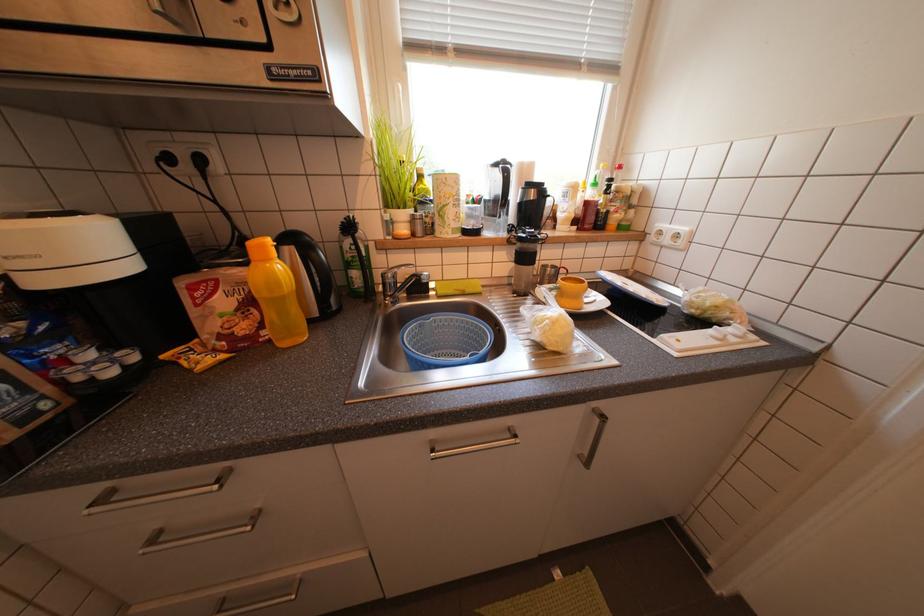
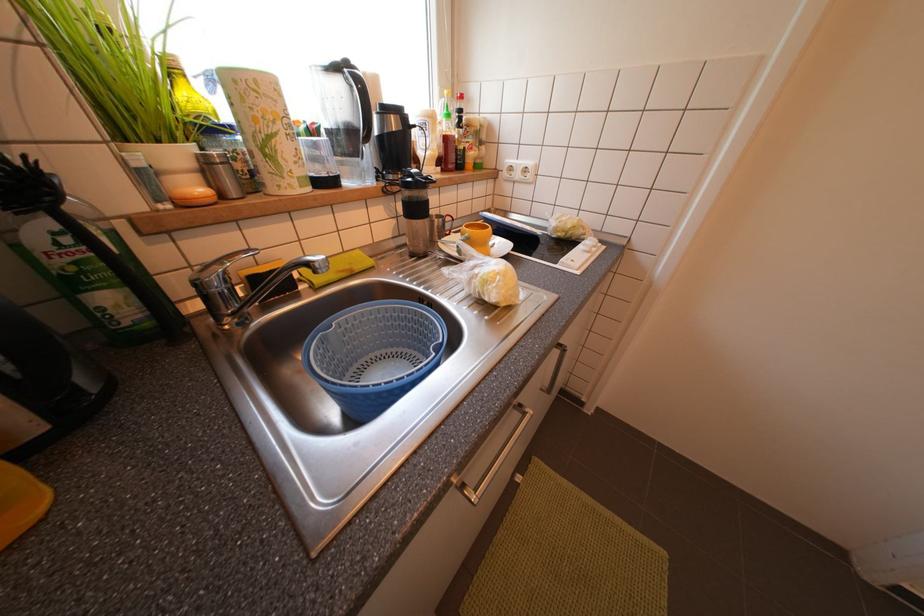
Question: The first image is from the beginning of the video and the second image is from the end. How did the camera likely rotate when shooting the video?

Choices:
 (A) Left
 (B) Right
 (C) Up
 (D) Down

Answer: (B)